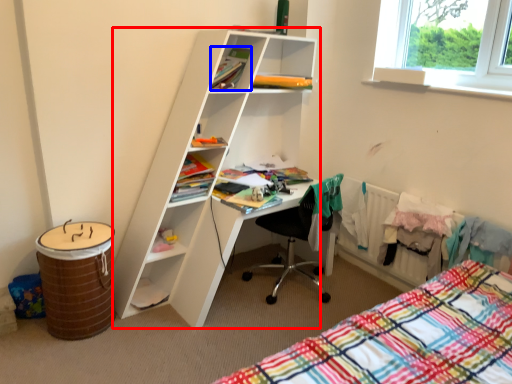
Question: Among these objects, which one is farthest to the camera, shelf (highlighted by a red box) or book (highlighted by a blue box)?

Choices:
 (A) shelf
 (B) book

Answer: (B)